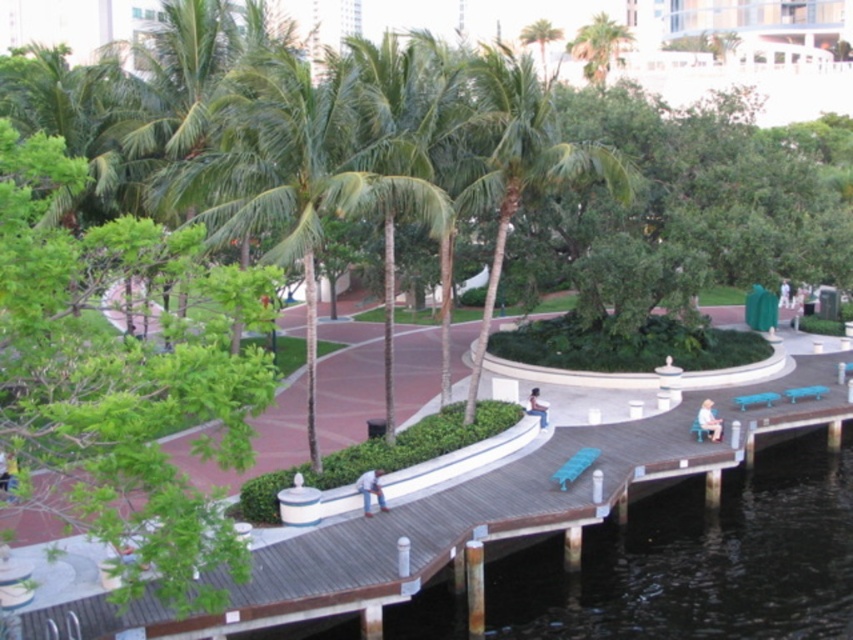
Question: Which of the following is the closest to the observer?

Choices:
 (A) (712, 429)
 (B) (602, 84)

Answer: (A)

Question: Observing the image, what is the correct spatial positioning of wooden dock at center in reference to green leafy palm tree at upper center?

Choices:
 (A) right
 (B) left

Answer: (B)

Question: Is wooden dock at center thinner than light blue jeans at lower center?

Choices:
 (A) yes
 (B) no

Answer: (B)

Question: In this image, where is green leafy palm tree at center located relative to light brown leather jacket at lower left?

Choices:
 (A) below
 (B) above

Answer: (B)

Question: Among these points, which one is nearest to the camera?

Choices:
 (A) (376, 468)
 (B) (318, 372)

Answer: (A)

Question: Which object is positioned farthest from the light brown leather jacket at lower left?

Choices:
 (A) green leafy palm tree at center
 (B) blue fabric umbrella at upper right
 (C) wooden walkway at center

Answer: (B)